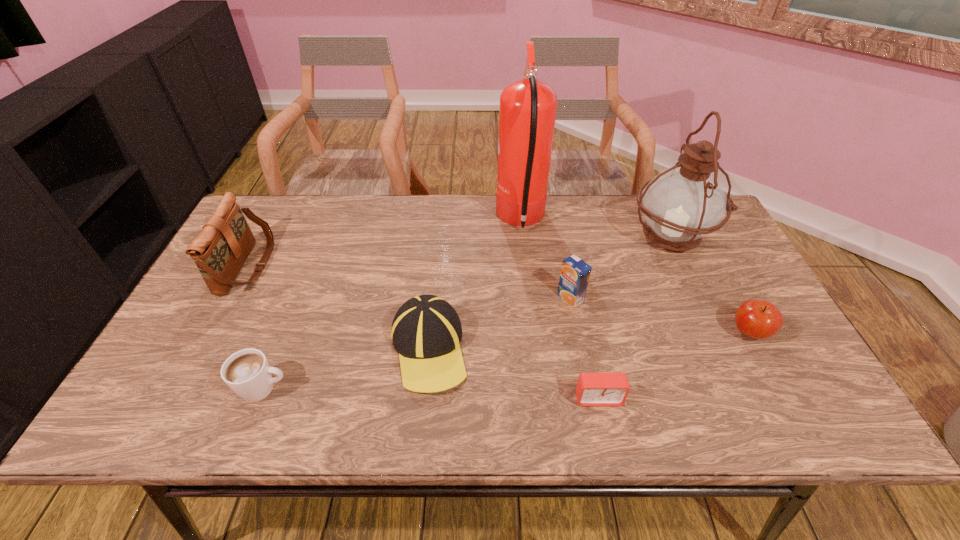
Identify the location of vacant area that lies between the apple and the cappuccino. Image resolution: width=960 pixels, height=540 pixels. (507, 361).

You are a GUI agent. You are given a task and a screenshot of the screen. Output one action in this format:
    pyautogui.click(x=<x>, y=<y>)
    Task: Click on the free spot between the second object from left to right and the sixth object from right to left
    The height and width of the screenshot is (540, 960).
    Given the screenshot: What is the action you would take?
    pyautogui.click(x=347, y=369)

At what (x,y) coordinates should I click in order to perform the action: click on vacant area that lies between the alarm clock and the second object from left to right. Please return your answer as a coordinate pair (x, y). This screenshot has width=960, height=540. Looking at the image, I should click on (431, 393).

Identify the location of object that is the seventh nearest to the apple. Image resolution: width=960 pixels, height=540 pixels. (220, 250).

Select which object is the third closest to the shoulder bag. Please provide its 2D coordinates. Your answer should be formatted as a tuple, i.e. [(x, y)], where the tuple contains the x and y coordinates of a point satisfying the conditions above.

[(527, 111)]

This screenshot has height=540, width=960. What are the coordinates of `free space that satisfies the following two spatial constraints: 1. on the front-facing side of the apple; 2. on the left side of the leftmost object` in the screenshot? It's located at (211, 333).

At what (x,y) coordinates should I click in order to perform the action: click on vacant space that satisfies the following two spatial constraints: 1. towards the nozzle of the fire extinguisher; 2. on the left side of the apple. Please return your answer as a coordinate pair (x, y). This screenshot has height=540, width=960. Looking at the image, I should click on (533, 333).

This screenshot has height=540, width=960. Find the location of `vacant position in the image that satisfies the following two spatial constraints: 1. on the front-facing side of the sixth shortest object; 2. on the back side of the apple`. vacant position in the image that satisfies the following two spatial constraints: 1. on the front-facing side of the sixth shortest object; 2. on the back side of the apple is located at coordinates (211, 333).